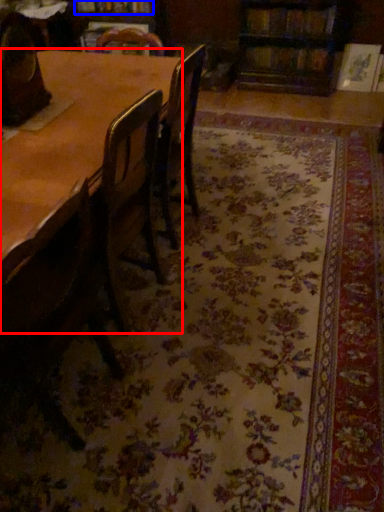
Question: Which object appears farthest to the camera in this image, table (highlighted by a red box) or book (highlighted by a blue box)?

Choices:
 (A) table
 (B) book

Answer: (B)